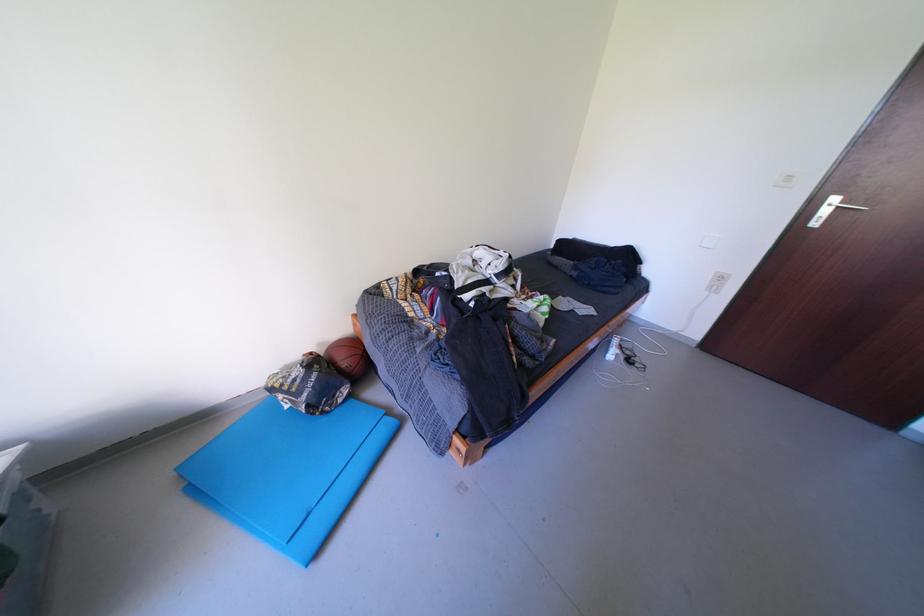
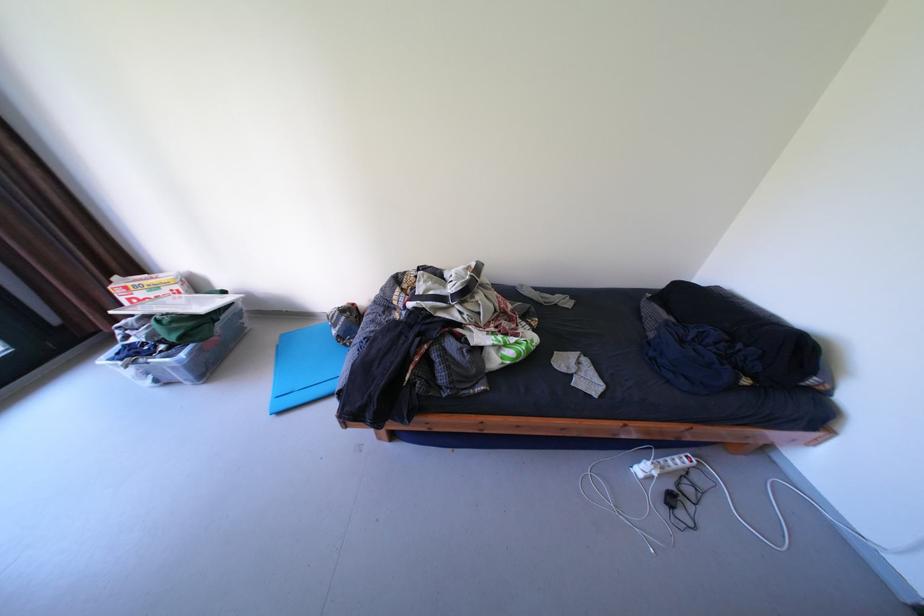
In the second image, find the point that corresponds to the point at 621,357 in the first image.

(649, 471)